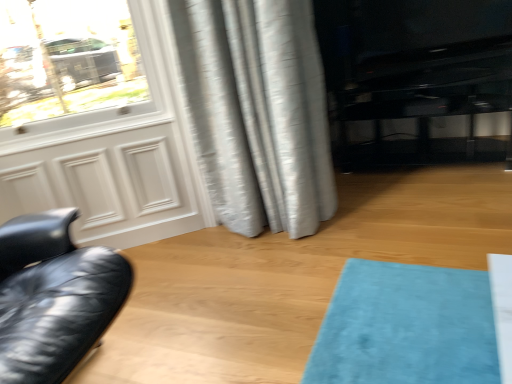
This screenshot has width=512, height=384. What do you see at coordinates (258, 112) in the screenshot? I see `silvery textured curtain at center` at bounding box center [258, 112].

Image resolution: width=512 pixels, height=384 pixels. I want to click on black glossy entertainment center at right, so click(417, 77).

Locate an element on the screen. This screenshot has height=384, width=512. entertainment center to the right of silvery textured curtain at center is located at coordinates (417, 77).

Which point is more distant from viewer, (417, 153) or (261, 192)?

Positioned behind is point (417, 153).

In terms of width, does black glossy entertainment center at right look wider or thinner when compared to silvery textured curtain at center?

black glossy entertainment center at right is wider than silvery textured curtain at center.

Is black glossy entertainment center at right shorter than matte white screen door at left?

Correct, black glossy entertainment center at right is not as tall as matte white screen door at left.

Is black glossy entertainment center at right positioned far away from matte white screen door at left?

That's right, there is a large distance between black glossy entertainment center at right and matte white screen door at left.

Who is bigger, black glossy entertainment center at right or matte white screen door at left?

With larger size is black glossy entertainment center at right.

From the image's perspective, is black glossy entertainment center at right beneath matte white screen door at left?

A: No, from the image's perspective, black glossy entertainment center at right is not beneath matte white screen door at left.

Find the location of a particular element. The height and width of the screenshot is (384, 512). entertainment center behind the matte white screen door at left is located at coordinates (417, 77).

Considering the sizes of objects matte white screen door at left and black glossy entertainment center at right in the image provided, who is thinner, matte white screen door at left or black glossy entertainment center at right?

matte white screen door at left.

Would you say matte white screen door at left is outside black glossy entertainment center at right?

matte white screen door at left is positioned outside black glossy entertainment center at right.

In terms of size, does matte white screen door at left appear bigger or smaller than black glossy entertainment center at right?

In the image, matte white screen door at left appears to be smaller than black glossy entertainment center at right.

Considering the relative sizes of silvery textured curtain at center and black glossy entertainment center at right in the image provided, is silvery textured curtain at center shorter than black glossy entertainment center at right?

No.

Between silvery textured curtain at center and black glossy entertainment center at right, which one appears on the left side from the viewer's perspective?

Positioned to the left is silvery textured curtain at center.

Could you tell me if silvery textured curtain at center is turned towards black glossy entertainment center at right?

No, silvery textured curtain at center does not turn towards black glossy entertainment center at right.

From the image's perspective, is silvery textured curtain at center beneath black glossy entertainment center at right?

Yes.

Is silvery textured curtain at center at the back of matte white screen door at left?

matte white screen door at left is not turned away from silvery textured curtain at center.

Looking at this image, considering the sizes of objects matte white screen door at left and silvery textured curtain at center in the image provided, who is smaller, matte white screen door at left or silvery textured curtain at center?

Smaller between the two is matte white screen door at left.

Can you confirm if matte white screen door at left is positioned to the right of silvery textured curtain at center?

In fact, matte white screen door at left is to the left of silvery textured curtain at center.

Is the surface of silvery textured curtain at center in direct contact with matte white screen door at left?

No, silvery textured curtain at center is not with matte white screen door at left.

Can you confirm if silvery textured curtain at center is wider than matte white screen door at left?

Indeed, silvery textured curtain at center has a greater width compared to matte white screen door at left.

Considering the relative sizes of silvery textured curtain at center and matte white screen door at left in the image provided, is silvery textured curtain at center smaller than matte white screen door at left?

No, silvery textured curtain at center is not smaller than matte white screen door at left.

Does silvery textured curtain at center contain matte white screen door at left?

No.

Find the location of a particular element. This screenshot has height=384, width=512. curtain in front of the black glossy entertainment center at right is located at coordinates (258, 112).

This screenshot has height=384, width=512. I want to click on entertainment center that appears on the right of matte white screen door at left, so click(x=417, y=77).

From the image, which object appears to be nearer to silvery textured curtain at center, matte white screen door at left or black glossy entertainment center at right?

The object closer to silvery textured curtain at center is matte white screen door at left.

Considering their positions, is silvery textured curtain at center positioned closer to black glossy entertainment center at right than matte white screen door at left?

Among the two, silvery textured curtain at center is located nearer to black glossy entertainment center at right.

From the image, which object appears to be farther from matte white screen door at left, silvery textured curtain at center or black glossy entertainment center at right?

black glossy entertainment center at right lies further to matte white screen door at left than the other object.

Looking at the image, which one is located closer to silvery textured curtain at center, black glossy entertainment center at right or matte white screen door at left?

matte white screen door at left is closer to silvery textured curtain at center.

When comparing their distances from matte white screen door at left, does black glossy entertainment center at right or silvery textured curtain at center seem further?

black glossy entertainment center at right is further to matte white screen door at left.

Based on their spatial positions, is matte white screen door at left or silvery textured curtain at center further from black glossy entertainment center at right?

Based on the image, matte white screen door at left appears to be further to black glossy entertainment center at right.

Locate an element on the screen. curtain located between matte white screen door at left and black glossy entertainment center at right in the left-right direction is located at coordinates (258, 112).